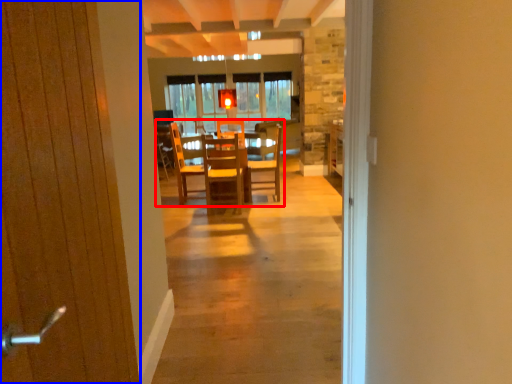
Question: Which of the following is the closest to the observer, kitchen & dining room table (highlighted by a red box) or door (highlighted by a blue box)?

Choices:
 (A) kitchen & dining room table
 (B) door

Answer: (B)